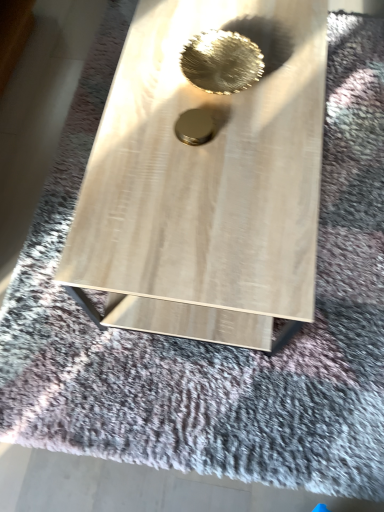
Find the location of `free space to the right of metallic gold bowl at center, acting as the 2th hole starting from the bottom`. free space to the right of metallic gold bowl at center, acting as the 2th hole starting from the bottom is located at coordinates point(292,69).